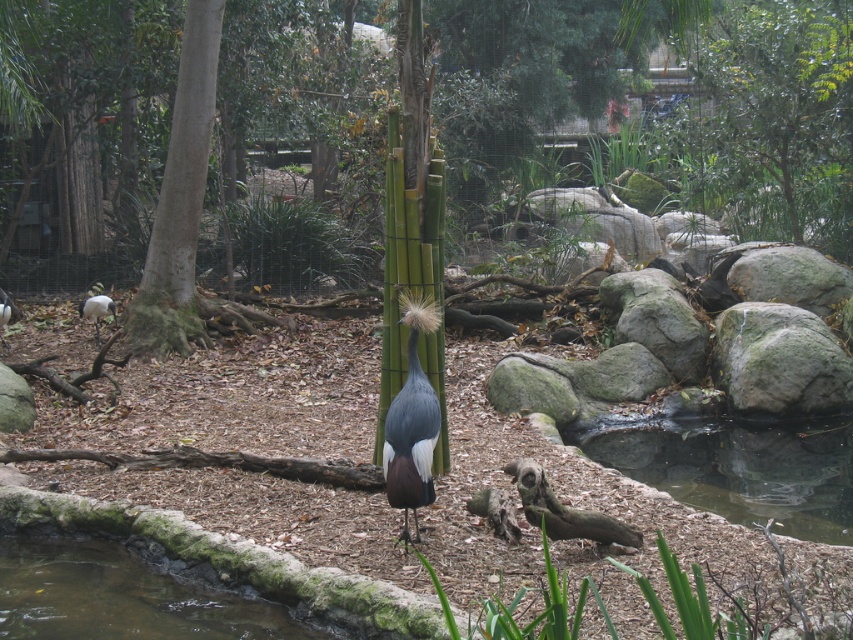
Is clear water at pond center wider than white glossy bird at left?

Yes.

Does clear water at pond center appear under white glossy bird at left?

Indeed, clear water at pond center is positioned under white glossy bird at left.

Describe the element at coordinates (120, 596) in the screenshot. This screenshot has width=853, height=640. I see `clear water at pond center` at that location.

This screenshot has width=853, height=640. In order to click on clear water at pond center in this screenshot , I will do `click(120, 596)`.

Can you confirm if clear water at pond right is positioned to the right of white glossy bird at center?

Correct, you'll find clear water at pond right to the right of white glossy bird at center.

Looking at this image, is the position of clear water at pond right less distant than that of white glossy bird at center?

That is True.

Image resolution: width=853 pixels, height=640 pixels. Identify the location of clear water at pond right. (743, 468).

Between clear water at pond right and gray matte bird at center, which one appears on the left side from the viewer's perspective?

gray matte bird at center is more to the left.

Who is lower down, clear water at pond right or gray matte bird at center?

clear water at pond right is lower down.

Is point (802, 445) positioned behind point (399, 420)?

Yes, point (802, 445) is farther from viewer.

Image resolution: width=853 pixels, height=640 pixels. Identify the location of clear water at pond right. (743, 468).